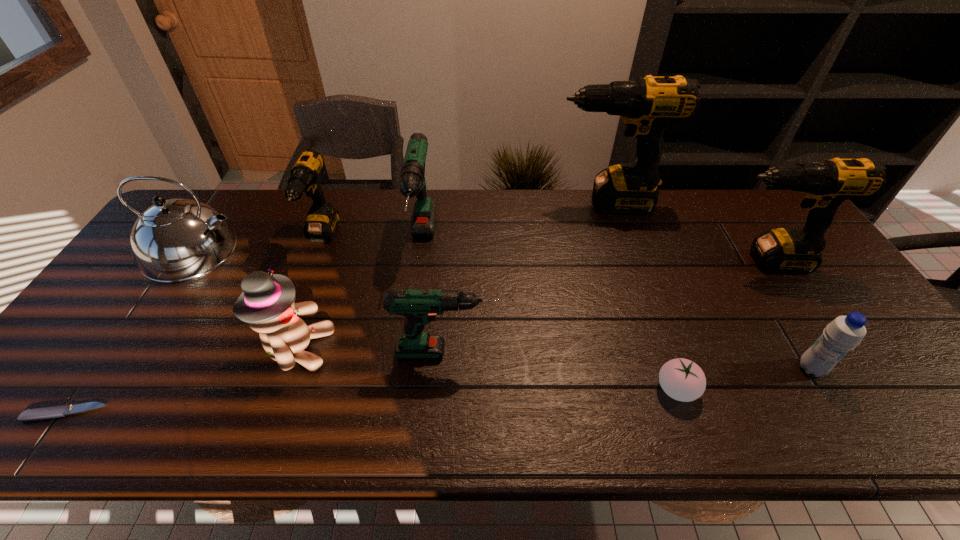
In the image, there is a desktop. Where is `free space at the far right corner`? This screenshot has width=960, height=540. free space at the far right corner is located at coordinates (779, 211).

In order to click on free area in between the second smallest black drill and the rag_doll in this screenshot , I will do `click(532, 305)`.

Locate an element on the screen. This screenshot has width=960, height=540. free space between the steak knife and the ninth tallest object is located at coordinates (372, 401).

The height and width of the screenshot is (540, 960). Identify the location of free space between the smallest black drill and the nearest drill. (385, 294).

Identify the location of blank region between the rightmost drill and the tomato. (721, 326).

You are a GUI agent. You are given a task and a screenshot of the screen. Output one action in this format:
    pyautogui.click(x=<x>, y=<y>)
    Task: Click on the unoccupied position between the second black drill from left to right and the leftmost drill
    This screenshot has height=540, width=960.
    Given the screenshot: What is the action you would take?
    pyautogui.click(x=464, y=220)

Identify the location of vacant space that's between the farther green drill and the kettle. tap(308, 247).

Where is `vacant space that is in between the leftmost drill and the water bottle`? The image size is (960, 540). vacant space that is in between the leftmost drill and the water bottle is located at coordinates (566, 303).

Identify the location of vacant space that's between the nearer green drill and the tallest drill. (527, 277).

Where is `vacant space in between the steak knife and the red tomato`? The image size is (960, 540). vacant space in between the steak knife and the red tomato is located at coordinates coord(372,401).